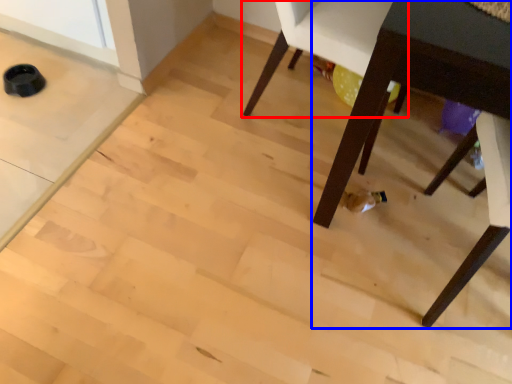
Question: Which point is further to the camera, chair (highlighted by a red box) or table (highlighted by a blue box)?

Choices:
 (A) chair
 (B) table

Answer: (A)